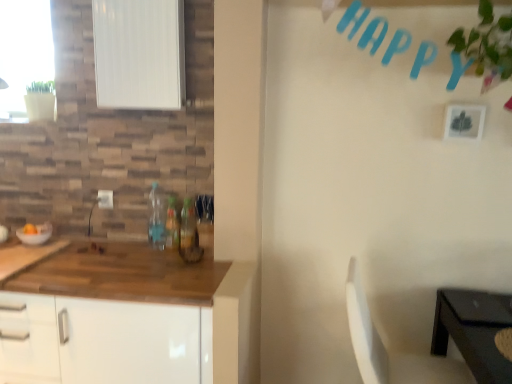
What do you see at coordinates (156, 218) in the screenshot?
I see `translucent plastic bottle at center, the first bottle viewed from the left` at bounding box center [156, 218].

What do you see at coordinates (36, 234) in the screenshot? I see `white glossy bowl at left` at bounding box center [36, 234].

What do you see at coordinates (188, 226) in the screenshot? The height and width of the screenshot is (384, 512). I see `translucent glass bottle at center, the third bottle positioned from the left` at bounding box center [188, 226].

The height and width of the screenshot is (384, 512). Describe the element at coordinates (464, 121) in the screenshot. I see `white matte picture frame at upper right` at that location.

The height and width of the screenshot is (384, 512). Identify the location of translucent plastic bottle at center, which is the 3th bottle from right to left. (156, 218).

From a real-world perspective, who is located lower, translucent plastic bottle at center, which is the 3th bottle from right to left, or white matte cabinet at lower left?

In real-world perspective, white matte cabinet at lower left is lower.

Can you confirm if translucent plastic bottle at center, which is the 3th bottle from right to left, is smaller than white matte cabinet at lower left?

Yes.

Measure the distance from translucent plastic bottle at center, the first bottle viewed from the left, to white matte cabinet at lower left.

translucent plastic bottle at center, the first bottle viewed from the left, and white matte cabinet at lower left are 23.76 inches apart from each other.

Which of these two, translucent plastic bottle at center, which is the 3th bottle from right to left, or white matte cabinet at lower left, is thinner?

Thinner between the two is translucent plastic bottle at center, which is the 3th bottle from right to left.

How many degrees apart are the facing directions of white plastic chair at lower right and translucent glass bottle at center, positioned as the 1th bottle in right-to-left order?

The angle between the facing direction of white plastic chair at lower right and the facing direction of translucent glass bottle at center, positioned as the 1th bottle in right-to-left order, is 83 degrees.

From the image's perspective, would you say white plastic chair at lower right is positioned over translucent glass bottle at center, positioned as the 1th bottle in right-to-left order?

No, from the image's perspective, white plastic chair at lower right is not on top of translucent glass bottle at center, positioned as the 1th bottle in right-to-left order.

Between white plastic chair at lower right and translucent glass bottle at center, positioned as the 1th bottle in right-to-left order, which one appears on the left side from the viewer's perspective?

translucent glass bottle at center, positioned as the 1th bottle in right-to-left order.

Considering the relative sizes of white plastic chair at lower right and translucent glass bottle at center, positioned as the 1th bottle in right-to-left order, in the image provided, is white plastic chair at lower right bigger than translucent glass bottle at center, positioned as the 1th bottle in right-to-left order,?

Yes, white plastic chair at lower right is bigger than translucent glass bottle at center, positioned as the 1th bottle in right-to-left order.

Based on the photo, which object is wider, white matte cabinet at lower left or translucent glass bottle at center, positioned as the 1th bottle in right-to-left order?

Wider between the two is white matte cabinet at lower left.

Could you tell me if white matte cabinet at lower left is turned towards translucent glass bottle at center, the third bottle positioned from the left?

No, white matte cabinet at lower left is not turned towards translucent glass bottle at center, the third bottle positioned from the left.

Considering the sizes of wooden cutting board at lower left and translucent glass bottle at center, the third bottle positioned from the left, in the image, is wooden cutting board at lower left taller or shorter than translucent glass bottle at center, the third bottle positioned from the left,?

In the image, wooden cutting board at lower left appears to be shorter than translucent glass bottle at center, the third bottle positioned from the left.

Are wooden cutting board at lower left and translucent glass bottle at center, positioned as the 1th bottle in right-to-left order, far apart?

No, wooden cutting board at lower left is in close proximity to translucent glass bottle at center, positioned as the 1th bottle in right-to-left order.

Does point (23, 266) lie behind point (191, 200)?

No, (23, 266) is closer to viewer.

From the image's perspective, is wooden cutting board at lower left under translucent glass bottle at center, the third bottle positioned from the left?

Yes, from the image's perspective, wooden cutting board at lower left is below translucent glass bottle at center, the third bottle positioned from the left.

Considering the sizes of wooden cutting board at lower left and translucent plastic bottle at center, which is the 3th bottle from right to left, in the image, is wooden cutting board at lower left wider or thinner than translucent plastic bottle at center, which is the 3th bottle from right to left,?

Clearly, wooden cutting board at lower left has more width compared to translucent plastic bottle at center, which is the 3th bottle from right to left.

What's the angular difference between wooden cutting board at lower left and translucent plastic bottle at center, which is the 3th bottle from right to left,'s facing directions?

There is a 1.61-degree angle between the facing directions of wooden cutting board at lower left and translucent plastic bottle at center, which is the 3th bottle from right to left.

Would you say wooden cutting board at lower left is inside or outside translucent plastic bottle at center, which is the 3th bottle from right to left?

wooden cutting board at lower left is spatially situated outside translucent plastic bottle at center, which is the 3th bottle from right to left.

From the image's perspective, which object appears higher, wooden cutting board at lower left or translucent plastic bottle at center, the first bottle viewed from the left?

From the image's view, translucent plastic bottle at center, the first bottle viewed from the left, is above.

From the image's perspective, is green leafy plant at upper right located above or below white plastic chair at lower right?

green leafy plant at upper right is above white plastic chair at lower right.

Is white plastic chair at lower right at the back of green leafy plant at upper right?

No, green leafy plant at upper right's orientation is not away from white plastic chair at lower right.

Does green leafy plant at upper right have a smaller size compared to white plastic chair at lower right?

Correct, green leafy plant at upper right occupies less space than white plastic chair at lower right.

Is green leafy plant at upper right shorter than white plastic chair at lower right?

Yes, green leafy plant at upper right is shorter than white plastic chair at lower right.

Is white plastic chair at lower right oriented away from translucent plastic bottle at center, the first bottle viewed from the left?

Correct, white plastic chair at lower right is looking away from translucent plastic bottle at center, the first bottle viewed from the left.

At what (x,y) coordinates should I click in order to perform the action: click on chair on the right of translucent plastic bottle at center, which is the 3th bottle from right to left. Please return your answer as a coordinate pair (x, y). Looking at the image, I should click on (387, 351).

In terms of height, does white plastic chair at lower right look taller or shorter compared to translucent plastic bottle at center, which is the 3th bottle from right to left?

white plastic chair at lower right is taller than translucent plastic bottle at center, which is the 3th bottle from right to left.

Is white plastic chair at lower right far away from translucent plastic bottle at center, the first bottle viewed from the left?

Indeed, white plastic chair at lower right is not near translucent plastic bottle at center, the first bottle viewed from the left.

This screenshot has height=384, width=512. Identify the location of the 1st bottle to the right of the white matte cabinet at lower left, counting from the anchor's position. (156, 218).

From the image's perspective, starting from the white plastic chair at lower right, which bottle is the 1st one above? Please provide its 2D coordinates.

[(188, 226)]

From the image, which object appears to be nearer to white matte cabinet at lower left, wooden cutting board at lower left or white plastic chair at lower right?

Based on the image, wooden cutting board at lower left appears to be nearer to white matte cabinet at lower left.

Based on the photo, when comparing their distances from green leafy plant at upper right, does translucent plastic bottle at center, the first bottle viewed from the left, or white matte window screen at upper left seem further?

translucent plastic bottle at center, the first bottle viewed from the left, lies further to green leafy plant at upper right than the other object.

Based on their spatial positions, is translucent plastic bottle at center, the first bottle viewed from the left, or green leafy plant at upper right closer to white matte window screen at upper left?

Based on the image, translucent plastic bottle at center, the first bottle viewed from the left, appears to be nearer to white matte window screen at upper left.

When comparing their distances from white matte window screen at upper left, does translucent plastic bottle at center, which is the 3th bottle from right to left, or white matte cabinet at lower left seem further?

white matte cabinet at lower left.

Based on their spatial positions, is white matte window screen at upper left or white matte cabinet at lower left closer to green leafy plant at upper right?

Based on the image, white matte window screen at upper left appears to be nearer to green leafy plant at upper right.

When comparing their distances from white matte cabinet at lower left, does white matte picture frame at upper right or translucent plastic bottle at center, which is the 3th bottle from right to left, seem closer?

translucent plastic bottle at center, which is the 3th bottle from right to left, is closer to white matte cabinet at lower left.

In the scene shown: Based on their spatial positions, is white matte window screen at upper left or translucent glass bottle at center, the third bottle positioned from the left, closer to white glossy bowl at left?

Based on the image, translucent glass bottle at center, the third bottle positioned from the left, appears to be nearer to white glossy bowl at left.

Based on their spatial positions, is translucent plastic bottle at center, which is the second bottle in left-to-right order, or green leafy plant at upper right closer to translucent glass bottle at center, the third bottle positioned from the left?

translucent plastic bottle at center, which is the second bottle in left-to-right order, is closer to translucent glass bottle at center, the third bottle positioned from the left.

Locate an element on the screen. This screenshot has height=384, width=512. window screen located between wooden cutting board at lower left and green leafy plant at upper right in the left-right direction is located at coordinates (139, 54).

Find the location of a particular element. cabinetry between white glossy bowl at left and translucent glass bottle at center, positioned as the 1th bottle in right-to-left order, in the horizontal direction is located at coordinates (102, 341).

The image size is (512, 384). In order to click on bottle between translucent plastic bottle at center, which is the second bottle in left-to-right order, and white matte picture frame at upper right from left to right in this screenshot , I will do `click(188, 226)`.

Identify the location of chair between translucent plastic bottle at center, the first bottle viewed from the left, and white matte picture frame at upper right from left to right. (387, 351).